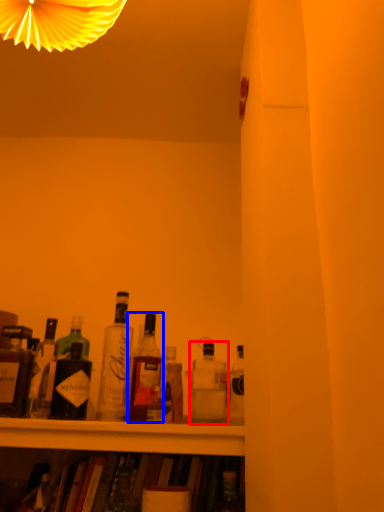
Question: Which of the following is the closest to the observer, bottle (highlighted by a red box) or bottle (highlighted by a blue box)?

Choices:
 (A) bottle
 (B) bottle

Answer: (A)